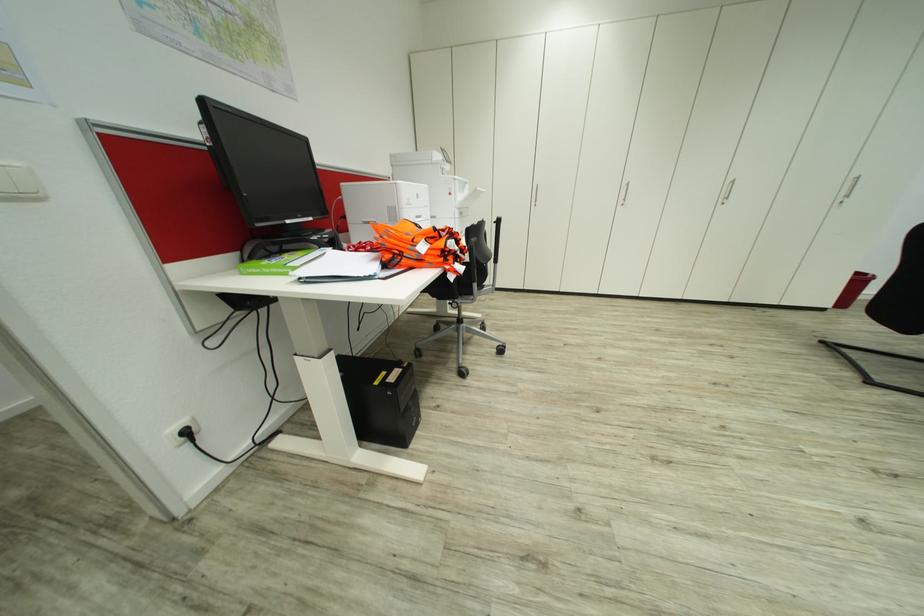
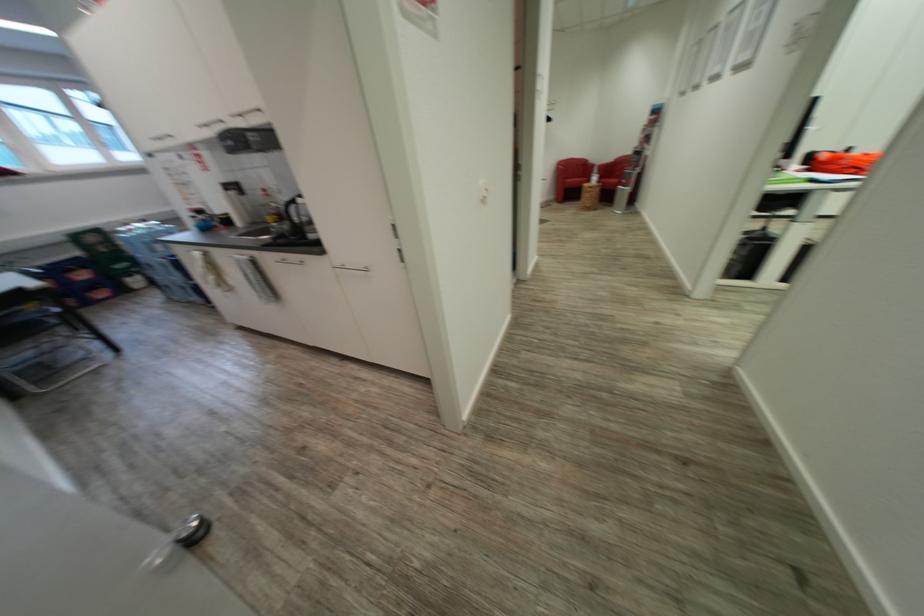
What movement of the cameraman would produce the second image?

The cameraman moved toward left, backward.